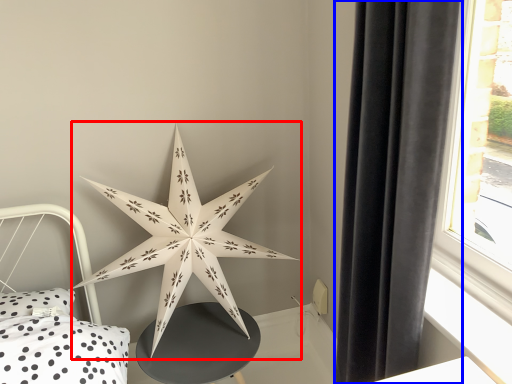
Question: Which object appears closest to the camera in this image, star (highlighted by a red box) or curtain (highlighted by a blue box)?

Choices:
 (A) star
 (B) curtain

Answer: (B)